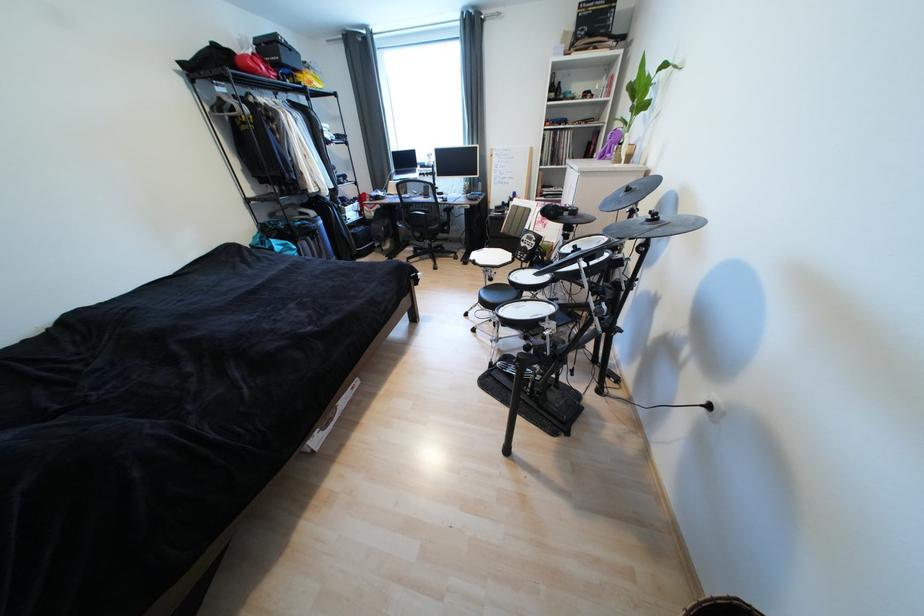
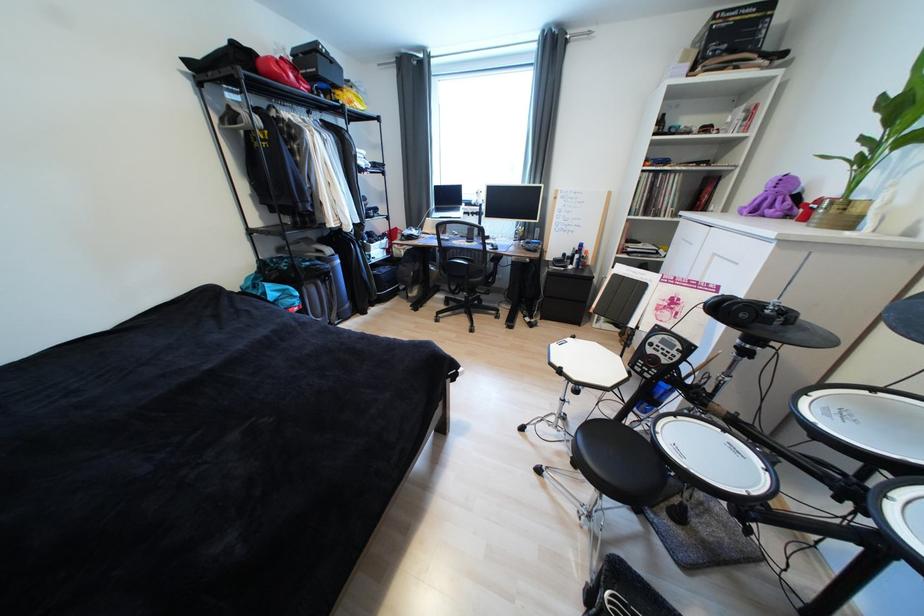
Question: How did the camera likely rotate?

Choices:
 (A) Left
 (B) Right
 (C) Up
 (D) Down

Answer: (C)